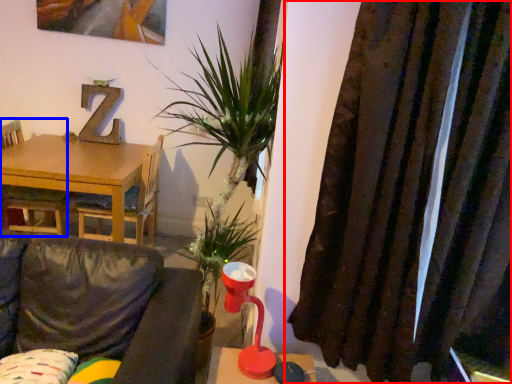
Question: Among these objects, which one is nearest to the camera, curtain (highlighted by a red box) or chair (highlighted by a blue box)?

Choices:
 (A) curtain
 (B) chair

Answer: (A)